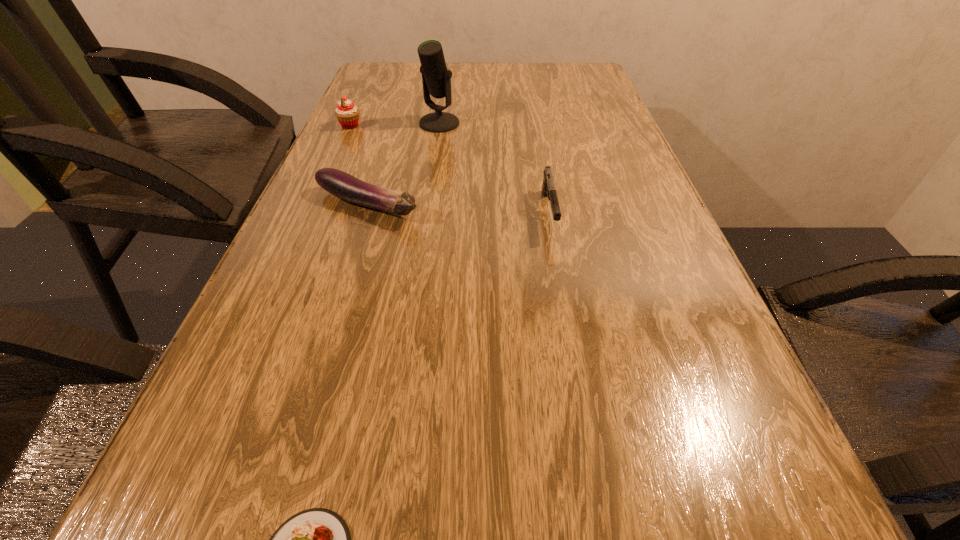
The width and height of the screenshot is (960, 540). In order to click on the tallest object in this screenshot , I will do `click(436, 79)`.

The height and width of the screenshot is (540, 960). Identify the location of cupcake. (347, 113).

At what (x,y) coordinates should I click in order to perform the action: click on the rightmost object. Please return your answer as a coordinate pair (x, y). Image resolution: width=960 pixels, height=540 pixels. Looking at the image, I should click on (548, 190).

You are a GUI agent. You are given a task and a screenshot of the screen. Output one action in this format:
    pyautogui.click(x=<x>, y=<y>)
    Task: Click on the eggplant
    This screenshot has height=540, width=960.
    Given the screenshot: What is the action you would take?
    pyautogui.click(x=342, y=185)

Where is `free location located 0.350m on the front of the microphone`? Image resolution: width=960 pixels, height=540 pixels. free location located 0.350m on the front of the microphone is located at coordinates (426, 214).

Find the location of `free space located 0.390m on the right of the cupcake`. free space located 0.390m on the right of the cupcake is located at coordinates (508, 126).

You are a GUI agent. You are given a task and a screenshot of the screen. Output one action in this format:
    pyautogui.click(x=<x>, y=<y>)
    Task: Click on the free space located at the muzzle end of the rightmost object
    
    Given the screenshot: What is the action you would take?
    pyautogui.click(x=571, y=333)

I want to click on blank space located 0.280m on the back of the eggplant, so click(392, 127).

Find the location of a particular element. This screenshot has height=540, width=960. cupcake situated at the left edge is located at coordinates tap(347, 113).

At what (x,y) coordinates should I click in order to perform the action: click on eggplant that is at the left edge. Please return your answer as a coordinate pair (x, y). This screenshot has width=960, height=540. Looking at the image, I should click on (342, 185).